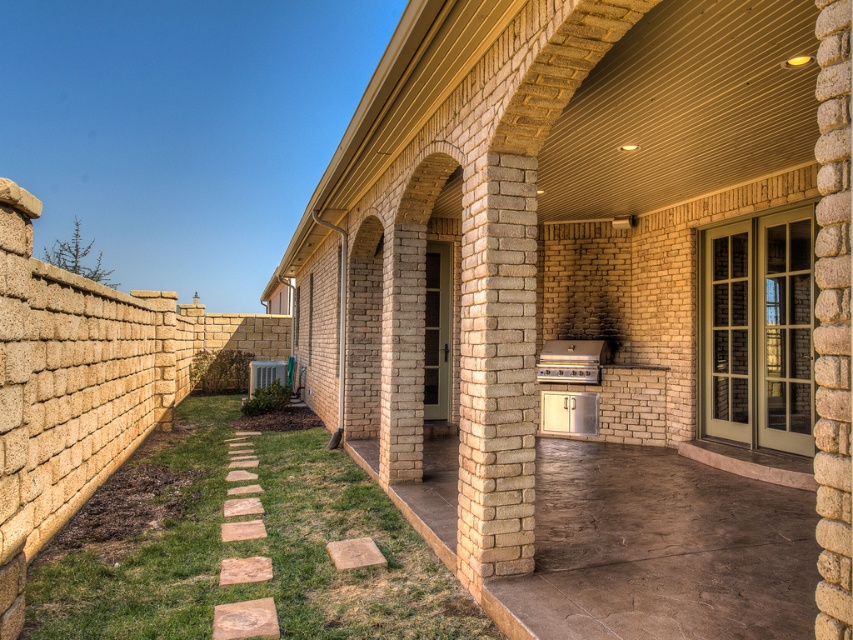
You are planning to cook a large meal for a family gathering and need a grill with enough space. Which grill, the matte brick grill at center or the matte stainless steel grill at center, would you choose based on their sizes?

The matte brick grill at center has a larger size compared to the matte stainless steel grill at center, so it would be the better choice for cooking a large meal.

You are planning to place a new grill on the patio. You have two options available for placement. The first option is the matte brick grill at center, and the second is the matte stainless steel grill at center. Given that you want to choose the wider grill for more cooking space, which one should you select?

The matte brick grill at center is wider than the matte stainless steel grill at center, so you should select the matte brick grill at center for more cooking space.